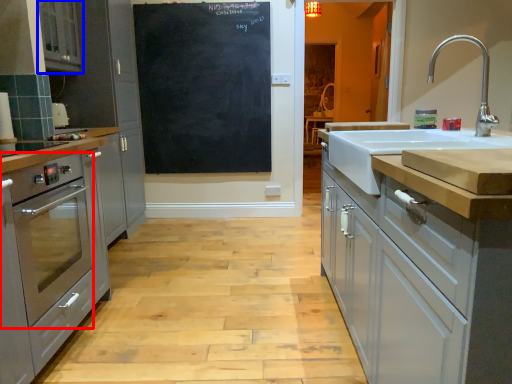
Question: Which object is closer to the camera taking this photo, home appliance (highlighted by a red box) or cabinetry (highlighted by a blue box)?

Choices:
 (A) home appliance
 (B) cabinetry

Answer: (A)